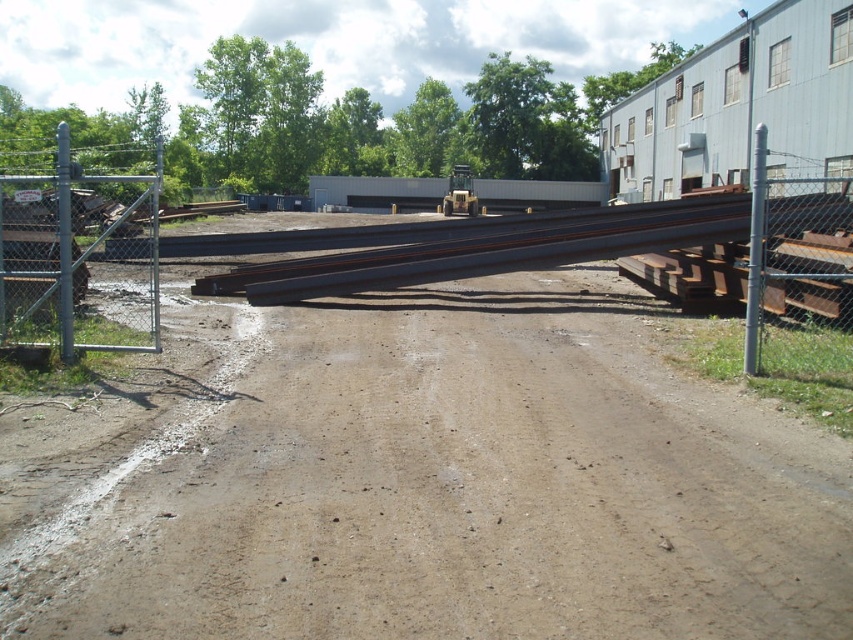
You are a delivery driver who needs to park your truck near the gray metallic pole at right without blocking the rusty metal train track at center. Based on their positions, can you park the truck safely?

The rusty metal train track at center is located below the gray metallic pole at right, meaning the pole is above the track. Since the truck can be parked near the pole without obstructing the track below, you can park safely.